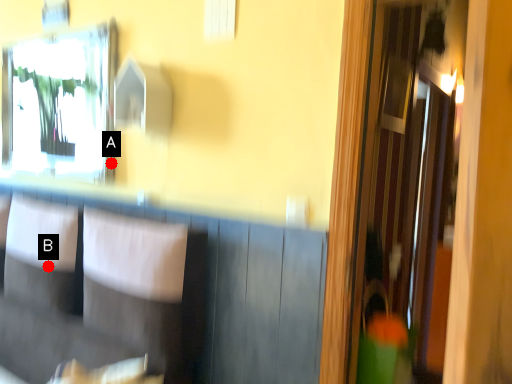
Question: Two points are circled on the image, labeled by A and B beside each circle. Which point is closer to the camera taking this photo?

Choices:
 (A) A is closer
 (B) B is closer

Answer: (B)